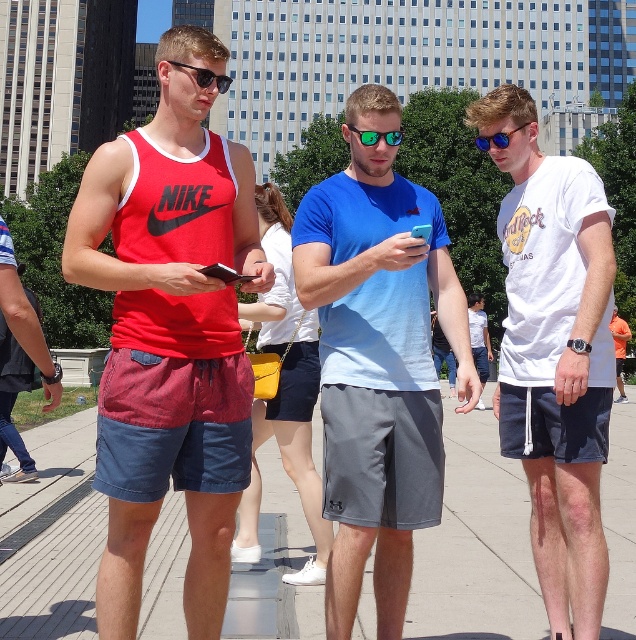
Question: Can you confirm if blue cotton shirt at center is thinner than orange fabric shirt at center?

Choices:
 (A) no
 (B) yes

Answer: (B)

Question: Which point is farther to the camera?

Choices:
 (A) (378, 221)
 (B) (551, 291)
 (C) (611, 627)
 (D) (619, 365)

Answer: (D)

Question: Is orange fabric shirt at center further to camera compared to green reflective sunglasses at center?

Choices:
 (A) no
 (B) yes

Answer: (A)

Question: Which point is farther from the camera taking this photo?

Choices:
 (A) (391, 141)
 (B) (499, 369)
 (C) (422, 618)

Answer: (C)

Question: Which of the following is the closest to the observer?

Choices:
 (A) (357, 138)
 (B) (576, 272)
 (C) (616, 397)
 (D) (515, 573)

Answer: (A)

Question: Can you confirm if matte red tank top at center is positioned to the left of concrete pavement at center?

Choices:
 (A) yes
 (B) no

Answer: (A)